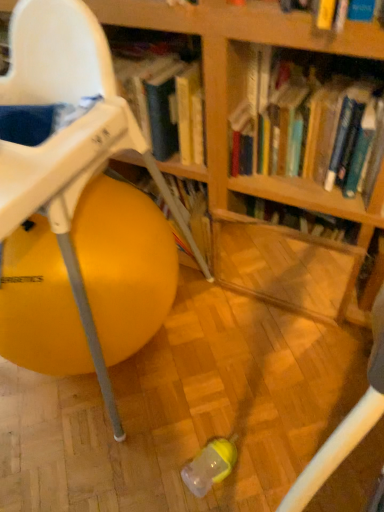
Describe the element at coordinates (68, 139) in the screenshot. I see `yellow rubber ball at left` at that location.

At what (x,y) coordinates should I click in order to perform the action: click on yellow rubber ball at left. Please return your answer as a coordinate pair (x, y). The image size is (384, 512). Looking at the image, I should click on (68, 139).

Describe the element at coordinates (316, 113) in the screenshot. I see `hardcover book at upper center` at that location.

In order to face hardcover book at upper center, should I rotate leftwards or rightwards?

To face it directly, rotate right by 16.835 degrees.

Locate an element on the screen. hardcover book at upper center is located at coordinates (316, 113).

At what (x,y) coordinates should I click in order to perform the action: click on yellow rubber ball at left. Please return your answer as a coordinate pair (x, y). The height and width of the screenshot is (512, 384). Looking at the image, I should click on (68, 139).

Which object is positioned more to the left, yellow rubber ball at left or hardcover book at upper center?

Positioned to the left is yellow rubber ball at left.

Considering the relative positions of yellow rubber ball at left and hardcover book at upper center in the image provided, is yellow rubber ball at left behind hardcover book at upper center?

No, the depth of yellow rubber ball at left is less than that of hardcover book at upper center.

Considering the positions of point (36, 34) and point (355, 146), is point (36, 34) closer or farther from the camera than point (355, 146)?

Point (36, 34) appears to be closer to the viewer than point (355, 146).

Consider the image. From the image's perspective, is yellow rubber ball at left above hardcover book at upper center?

No.

Consider the image. From a real-world perspective, between yellow rubber ball at left and hardcover book at upper center, who is vertically lower?

yellow rubber ball at left.

Is yellow rubber ball at left wider or thinner than hardcover book at upper center?

yellow rubber ball at left is wider than hardcover book at upper center.

Does yellow rubber ball at left have a lesser height compared to hardcover book at upper center?

No.

Who is bigger, yellow rubber ball at left or hardcover book at upper center?

With larger size is yellow rubber ball at left.

Choose the correct answer: Is yellow rubber ball at left inside hardcover book at upper center or outside it?

yellow rubber ball at left is outside hardcover book at upper center.

Can you see yellow rubber ball at left touching hardcover book at upper center?

yellow rubber ball at left and hardcover book at upper center are clearly separated.

Does yellow rubber ball at left turn towards hardcover book at upper center?

No, yellow rubber ball at left is not oriented towards hardcover book at upper center.

Identify the location of chair in front of the hardcover book at upper center. The image size is (384, 512). (68, 139).

Between hardcover book at upper center and yellow rubber ball at left, which one appears on the right side from the viewer's perspective?

Positioned to the right is hardcover book at upper center.

Which object is closer to the camera, hardcover book at upper center or yellow rubber ball at left?

yellow rubber ball at left.

Considering the positions of point (340, 109) and point (80, 24), is point (340, 109) closer or farther from the camera than point (80, 24)?

Clearly, point (340, 109) is more distant from the camera than point (80, 24).

From the image's perspective, which object appears higher, hardcover book at upper center or yellow rubber ball at left?

hardcover book at upper center is shown above in the image.

From a real-world perspective, is hardcover book at upper center over yellow rubber ball at left?

Yes, from a real-world perspective, hardcover book at upper center is on top of yellow rubber ball at left.

Which object is thinner, hardcover book at upper center or yellow rubber ball at left?

hardcover book at upper center.

Which of these two, hardcover book at upper center or yellow rubber ball at left, stands shorter?

hardcover book at upper center is shorter.

Considering the sizes of objects hardcover book at upper center and yellow rubber ball at left in the image provided, who is smaller, hardcover book at upper center or yellow rubber ball at left?

hardcover book at upper center.

Is yellow rubber ball at left located within hardcover book at upper center?

No.

Based on the photo, is hardcover book at upper center far away from yellow rubber ball at left?

hardcover book at upper center is near yellow rubber ball at left, not far away.

Does hardcover book at upper center turn towards yellow rubber ball at left?

No.

How many degrees apart are the facing directions of hardcover book at upper center and yellow rubber ball at left?

hardcover book at upper center and yellow rubber ball at left are facing 0.000379 degrees away from each other.

You are a GUI agent. You are given a task and a screenshot of the screen. Output one action in this format:
    pyautogui.click(x=<x>, y=<y>)
    Task: Click on the chair lying on the left of hardcover book at upper center
    This screenshot has width=384, height=512.
    Given the screenshot: What is the action you would take?
    click(x=68, y=139)

This screenshot has height=512, width=384. I want to click on book behind the yellow rubber ball at left, so 316,113.

Find the location of a particular element. Image resolution: width=384 pixels, height=512 pixels. chair below the hardcover book at upper center (from the image's perspective) is located at coordinates (68, 139).